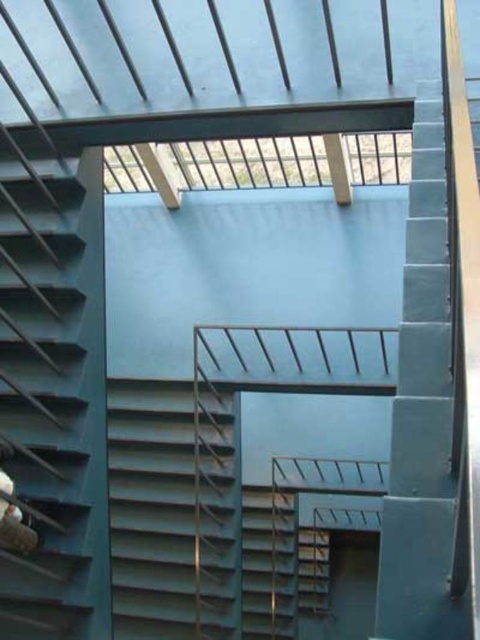
Between point (182, 524) and point (280, 593), which one is positioned in front?

Point (182, 524)

Between metallic gray stairs at center and metallic gray stair at center, which one is positioned higher?

metallic gray stairs at center

Does point (122, 378) lie in front of point (251, 502)?

Yes, it is.

Locate an element on the screen. metallic gray stairs at center is located at coordinates (151, 508).

Between metallic gray stairs at left and metallic gray stair at center, which one appears on the left side from the viewer's perspective?

metallic gray stairs at left

Can you confirm if metallic gray stairs at left is shorter than metallic gray stair at center?

No.

Which is in front, point (57, 305) or point (288, 570)?

Point (57, 305)

Locate an element on the screen. This screenshot has height=640, width=480. metallic gray stairs at left is located at coordinates (51, 381).

Between metallic gray stairs at left and metallic gray stairs at center, which one has more height?

metallic gray stairs at left is taller.

Looking at this image, can you confirm if metallic gray stairs at left is taller than metallic gray stairs at center?

Indeed, metallic gray stairs at left has a greater height compared to metallic gray stairs at center.

Find the location of `metallic gray stairs at left`. metallic gray stairs at left is located at coordinates (51, 381).